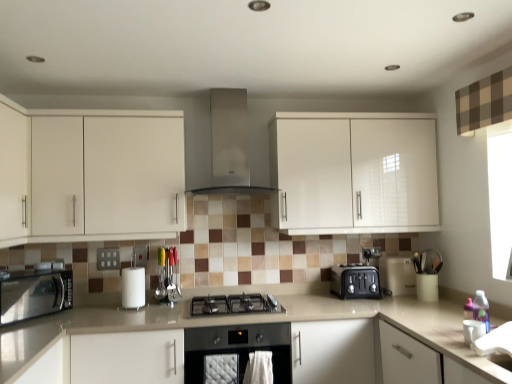
Find the location of a particular element. empty space that is ontop of satin silver range hood at center, arranged as the first home appliance when viewed from the top (from a real-world perspective) is located at coordinates (232, 86).